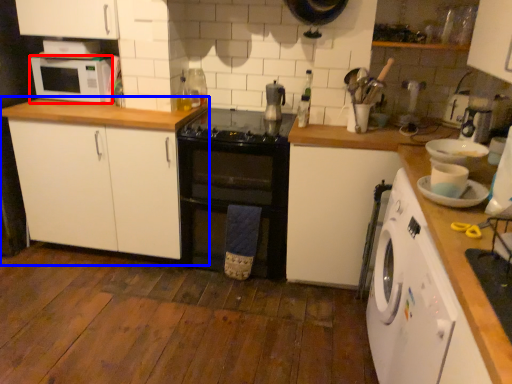
Question: Which of the following is the farthest to the observer, microwave oven (highlighted by a red box) or cabinetry (highlighted by a blue box)?

Choices:
 (A) microwave oven
 (B) cabinetry

Answer: (A)